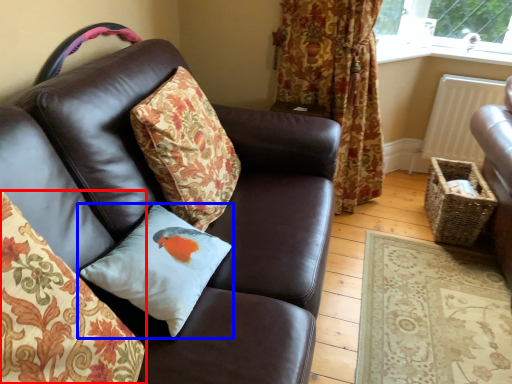
Question: Among these objects, which one is nearest to the camera, pillow (highlighted by a red box) or pillow (highlighted by a blue box)?

Choices:
 (A) pillow
 (B) pillow

Answer: (A)